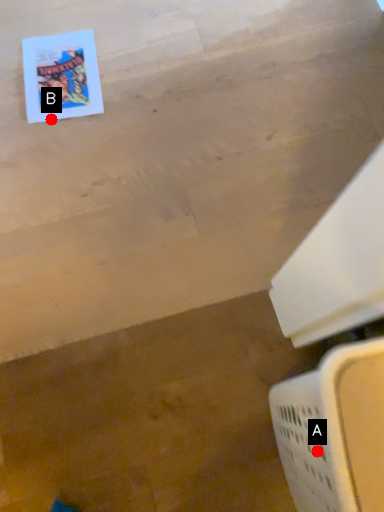
Question: Two points are circled on the image, labeled by A and B beside each circle. Which point appears closest to the camera in this image?

Choices:
 (A) A is closer
 (B) B is closer

Answer: (A)